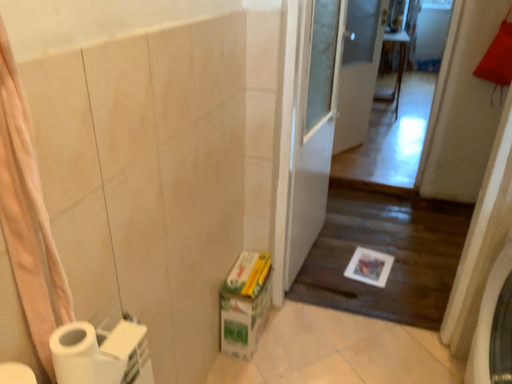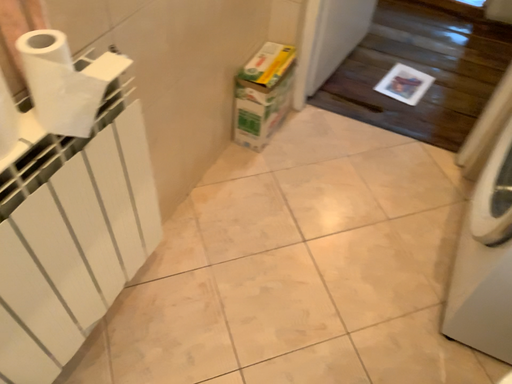
Question: How did the camera likely rotate when shooting the video?

Choices:
 (A) rotated right
 (B) rotated left

Answer: (B)